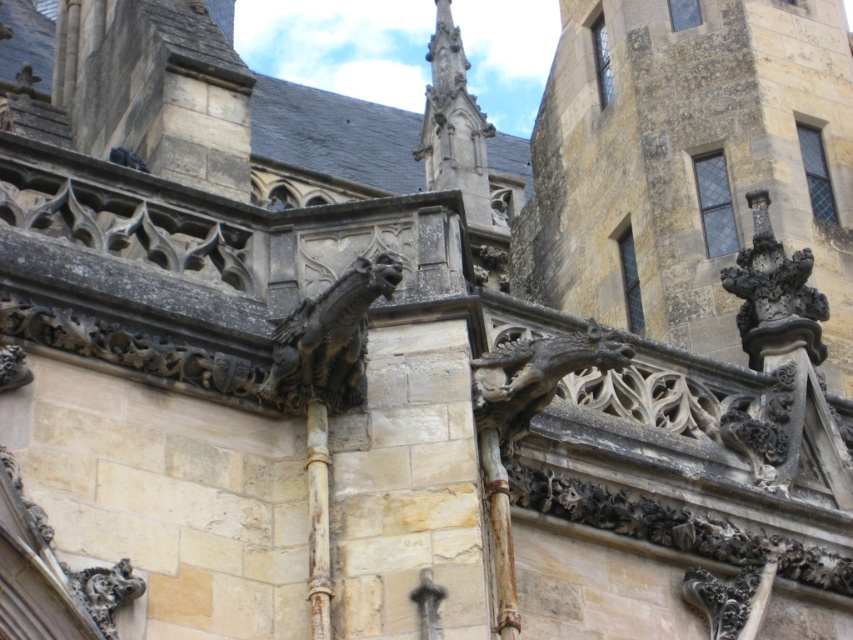
Question: Does dark stone gargoyle at center come in front of carved stone gargoyle at upper right?

Choices:
 (A) yes
 (B) no

Answer: (A)

Question: Can you confirm if dark stone gargoyle at center is wider than carved stone gargoyle at upper right?

Choices:
 (A) yes
 (B) no

Answer: (B)

Question: Which point appears farthest from the camera in this image?

Choices:
 (A) (374, 280)
 (B) (769, 310)

Answer: (B)

Question: Is dark stone gargoyle at center to the right of carved stone gargoyle at upper right from the viewer's perspective?

Choices:
 (A) yes
 (B) no

Answer: (B)